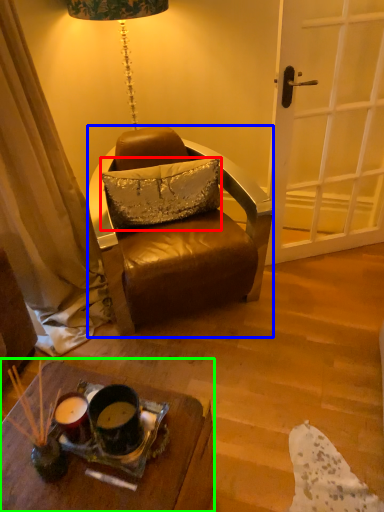
Question: Considering the real-world distances, which object is farthest from pillow (highlighted by a red box)? chair (highlighted by a blue box) or desk (highlighted by a green box)?

Choices:
 (A) chair
 (B) desk

Answer: (B)